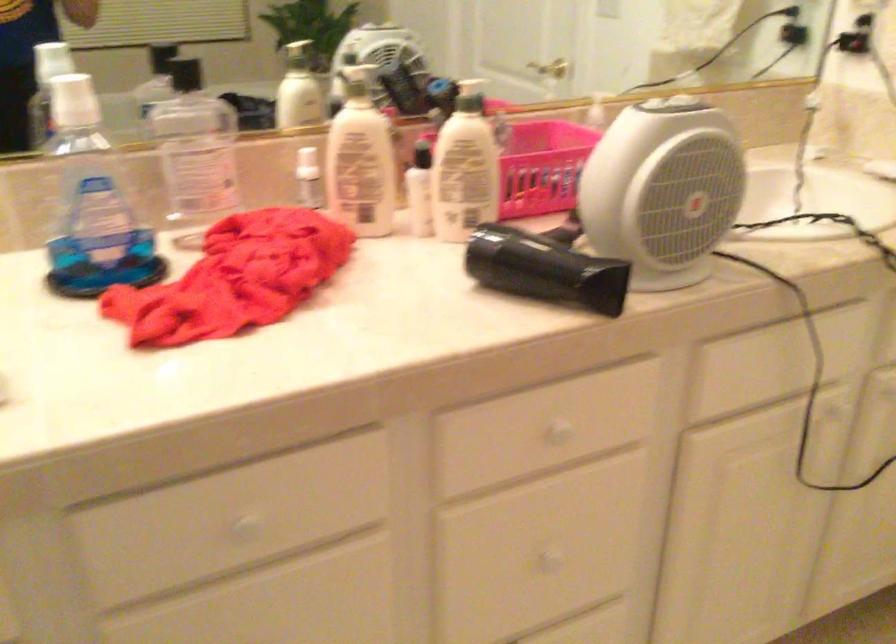
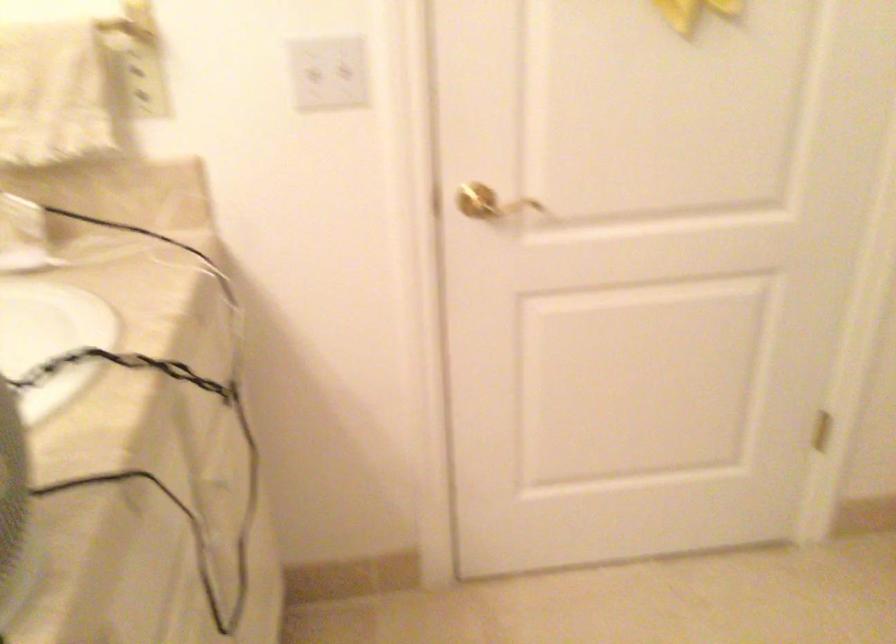
In the scene shown: How did the camera likely rotate?

The camera's rotation is toward right-down.